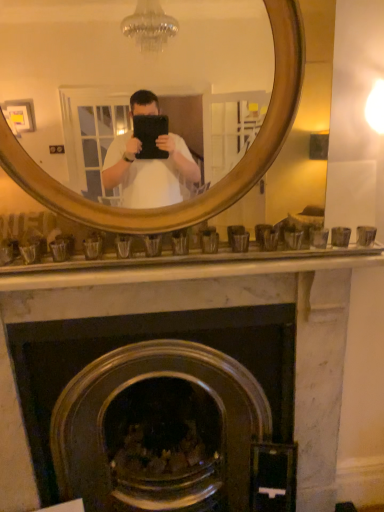
What is the approximate width of wooden mirror at upper center?

The width of wooden mirror at upper center is 5.59 inches.

Where is `wooden mirror at upper center`? The image size is (384, 512). wooden mirror at upper center is located at coordinates (125, 56).

What do you see at coordinates (125, 56) in the screenshot? This screenshot has height=512, width=384. I see `wooden mirror at upper center` at bounding box center [125, 56].

The height and width of the screenshot is (512, 384). Find the location of `marble fireplace at center`. marble fireplace at center is located at coordinates (161, 409).

What do you see at coordinates (161, 409) in the screenshot? The width and height of the screenshot is (384, 512). I see `marble fireplace at center` at bounding box center [161, 409].

Where is `wooden mirror at upper center`? This screenshot has height=512, width=384. wooden mirror at upper center is located at coordinates (125, 56).

Can you confirm if wooden mirror at upper center is positioned to the left of marble fireplace at center?

No.

Between wooden mirror at upper center and marble fireplace at center, which one is positioned behind?

marble fireplace at center is more distant.

Considering the points (210, 76) and (88, 355), which point is behind, point (210, 76) or point (88, 355)?

The point (88, 355) is behind.

From the image's perspective, is wooden mirror at upper center located beneath marble fireplace at center?

No.

From the picture: From a real-world perspective, who is located lower, wooden mirror at upper center or marble fireplace at center?

marble fireplace at center is physically lower.

Can you confirm if wooden mirror at upper center is wider than marble fireplace at center?

No, wooden mirror at upper center is not wider than marble fireplace at center.

Based on the photo, considering the relative sizes of wooden mirror at upper center and marble fireplace at center in the image provided, is wooden mirror at upper center shorter than marble fireplace at center?

Indeed, wooden mirror at upper center has a lesser height compared to marble fireplace at center.

Between wooden mirror at upper center and marble fireplace at center, which one has larger size?

marble fireplace at center is bigger.

Is wooden mirror at upper center surrounding marble fireplace at center?

Definitely not — marble fireplace at center is not inside wooden mirror at upper center.

Does wooden mirror at upper center touch marble fireplace at center?

No, wooden mirror at upper center is not beside marble fireplace at center.

Is wooden mirror at upper center looking in the opposite direction of marble fireplace at center?

No, wooden mirror at upper center's orientation is not away from marble fireplace at center.

How many degrees apart are the facing directions of wooden mirror at upper center and marble fireplace at center?

0.622 degrees separate the facing orientations of wooden mirror at upper center and marble fireplace at center.

Locate an element on the screen. mirror located in front of the marble fireplace at center is located at coordinates (125, 56).

Can you confirm if marble fireplace at center is positioned to the right of wooden mirror at upper center?

No.

Is the position of marble fireplace at center more distant than that of wooden mirror at upper center?

Yes, marble fireplace at center is further from the viewer.

Does point (159, 471) lie behind point (68, 61)?

Yes, point (159, 471) is behind point (68, 61).

Consider the image. From the image's perspective, does marble fireplace at center appear lower than wooden mirror at upper center?

Correct, marble fireplace at center appears lower than wooden mirror at upper center in the image.

From a real-world perspective, is marble fireplace at center below wooden mirror at upper center?

Yes, from a real-world perspective, marble fireplace at center is under wooden mirror at upper center.

Which of these two, marble fireplace at center or wooden mirror at upper center, is thinner?

wooden mirror at upper center is thinner.

Considering the sizes of objects marble fireplace at center and wooden mirror at upper center in the image provided, who is shorter, marble fireplace at center or wooden mirror at upper center?

wooden mirror at upper center.

Who is smaller, marble fireplace at center or wooden mirror at upper center?

wooden mirror at upper center is smaller.

Which is correct: marble fireplace at center is inside wooden mirror at upper center, or outside of it?

The correct answer is: outside.

Is marble fireplace at center far away from wooden mirror at upper center?

marble fireplace at center is actually quite close to wooden mirror at upper center.

Is marble fireplace at center aimed at wooden mirror at upper center?

No, marble fireplace at center does not turn towards wooden mirror at upper center.

What's the angular difference between marble fireplace at center and wooden mirror at upper center's facing directions?

The facing directions of marble fireplace at center and wooden mirror at upper center are 0.622 degrees apart.

You are a GUI agent. You are given a task and a screenshot of the screen. Output one action in this format:
    pyautogui.click(x=<x>, y=<y>)
    Task: Click on the fireplace below the wooden mirror at upper center (from a real-world perspective)
    The height and width of the screenshot is (512, 384).
    Given the screenshot: What is the action you would take?
    pyautogui.click(x=161, y=409)

Find the location of a particular element. The image size is (384, 512). mirror above the marble fireplace at center (from the image's perspective) is located at coordinates (125, 56).

The image size is (384, 512). Find the location of `fireplace below the wooden mirror at upper center (from a real-world perspective)`. fireplace below the wooden mirror at upper center (from a real-world perspective) is located at coordinates (161, 409).